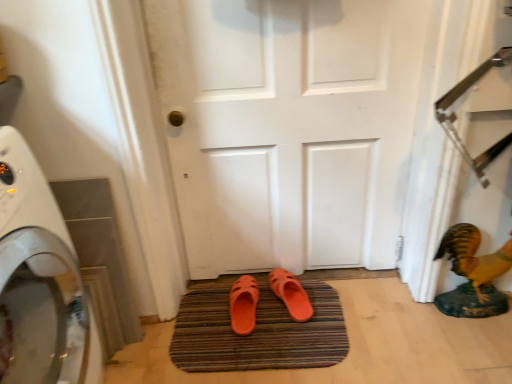
The height and width of the screenshot is (384, 512). Find the location of `free area in between orange rubber slipper at center, the 2th footwear from the right, and orange rubber slipper at center, the 2th footwear positioned from the left`. free area in between orange rubber slipper at center, the 2th footwear from the right, and orange rubber slipper at center, the 2th footwear positioned from the left is located at coordinates (268, 316).